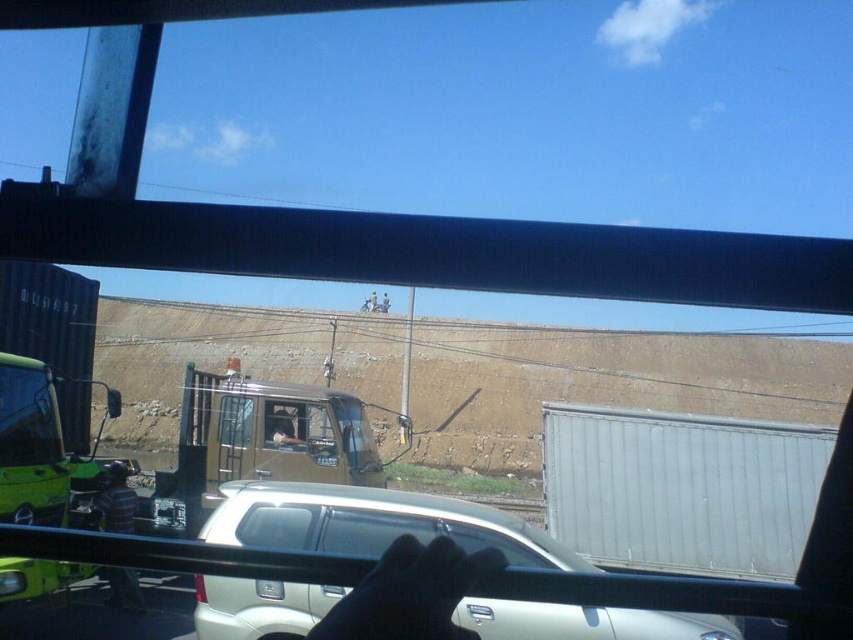
You are driving a car and want to make a left turn. There is a white matte car at center and a green matte windshield at left in your view. Which object would block your view if you turn left?

The white matte car at center is in front of the green matte windshield at left, so the white matte car at center would block your view when turning left.

You are a delivery driver who needs to reach the beige truck with its door open in the middle ground. You are currently standing next to the black leather glove at lower center. Can you walk directly to the beige truck without passing through the transparent glass car window at center?

The black leather glove at lower center and transparent glass car window at center are 4.73 meters apart, so yes, you can walk directly to the beige truck without passing through the transparent glass car window at center since they are separate objects with space between them.